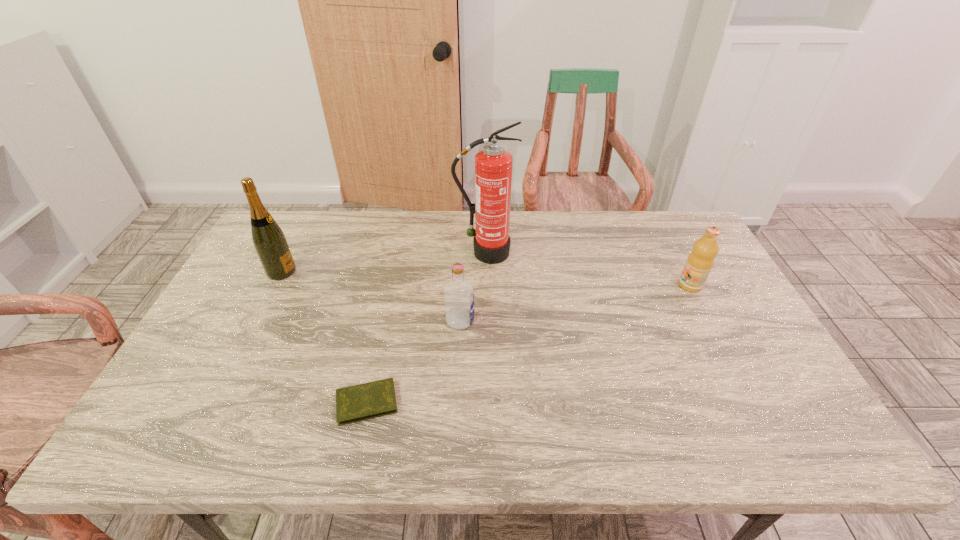
Where is `the tallest object`? This screenshot has width=960, height=540. the tallest object is located at coordinates (493, 165).

This screenshot has width=960, height=540. In order to click on the second tallest object in this screenshot , I will do `click(270, 243)`.

Locate an element on the screen. The width and height of the screenshot is (960, 540). wine bottle is located at coordinates click(270, 243).

The width and height of the screenshot is (960, 540). Find the location of `the rightmost object`. the rightmost object is located at coordinates (700, 261).

Where is `vodka`? The image size is (960, 540). vodka is located at coordinates (458, 293).

Find the location of a particular element. The image size is (960, 540). the nearest object is located at coordinates (370, 400).

At what (x,y) coordinates should I click in order to perform the action: click on the shortest object. Please return your answer as a coordinate pair (x, y). The image size is (960, 540). Looking at the image, I should click on (370, 400).

The image size is (960, 540). I want to click on free spot located on the front-facing side of the tallest object, so click(x=486, y=291).

Locate an element on the screen. This screenshot has width=960, height=540. free region located 0.380m on the front-facing side of the leftmost object is located at coordinates (417, 272).

This screenshot has height=540, width=960. I want to click on free space located on the front label of the rightmost object, so click(x=612, y=285).